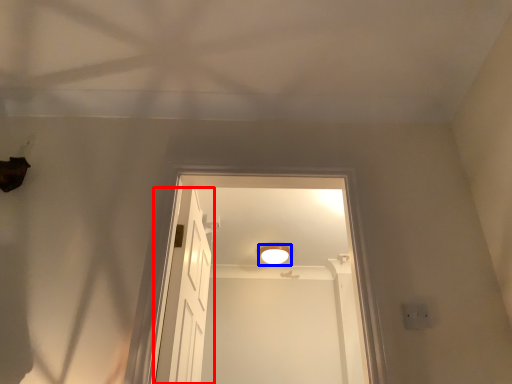
Question: Which of the following is the farthest to the observer, door (highlighted by a red box) or light fixture (highlighted by a blue box)?

Choices:
 (A) door
 (B) light fixture

Answer: (B)